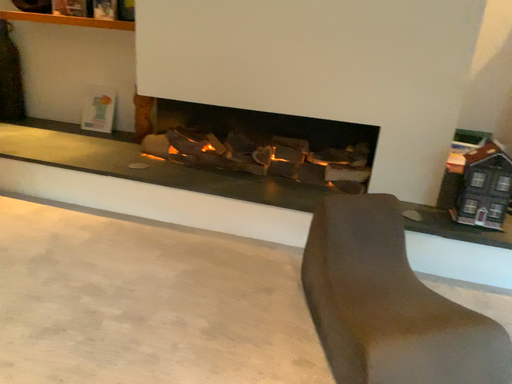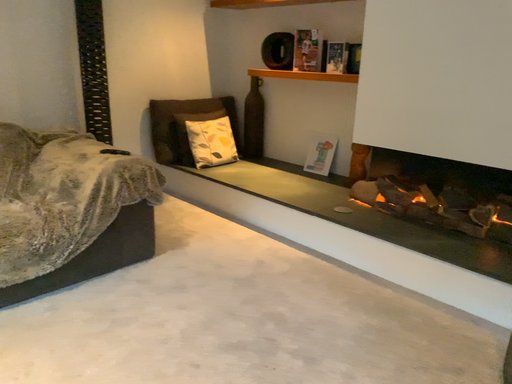
Question: Which way did the camera rotate in the video?

Choices:
 (A) rotated left
 (B) rotated right

Answer: (A)